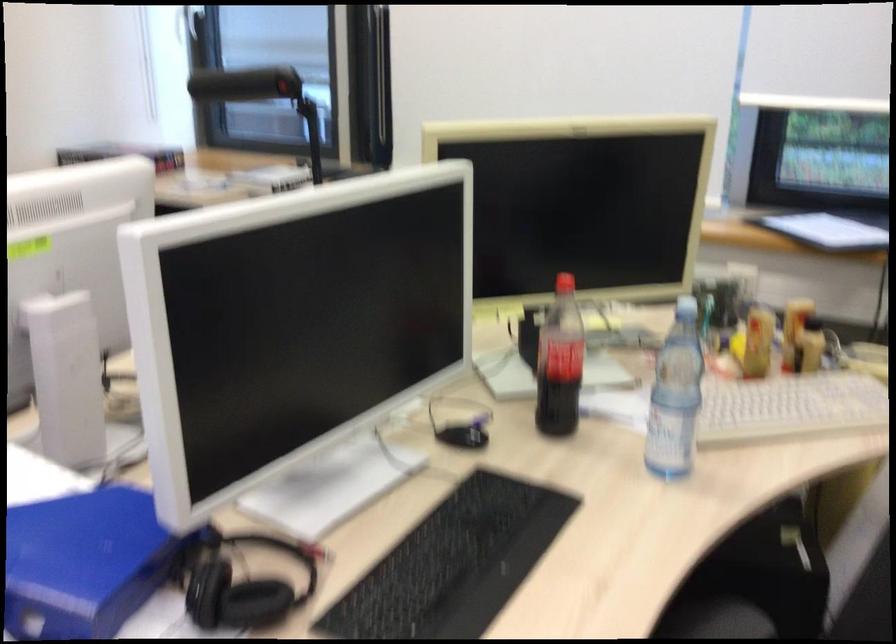
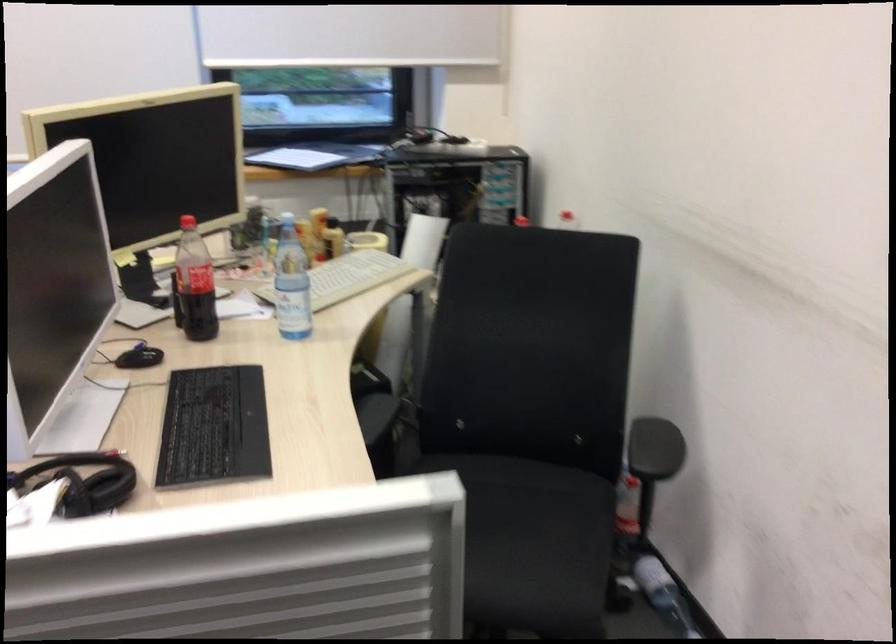
Find the pixel in the second image that matches (250,576) in the first image.

(81, 482)